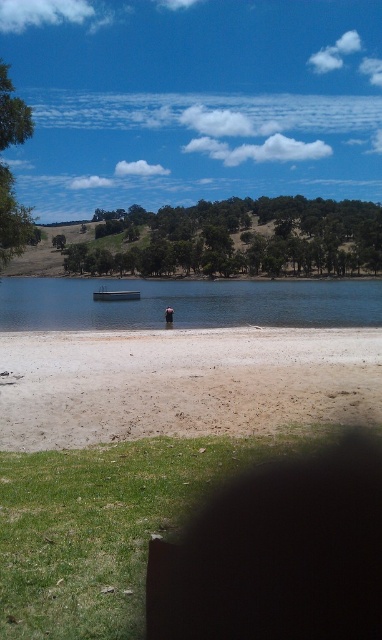
Question: Is brown sandy beach at lower center behind green leafy trees at upper center?

Choices:
 (A) yes
 (B) no

Answer: (B)

Question: Among these objects, which one is nearest to the camera?

Choices:
 (A) green leafy tree at left
 (B) clear blue water at center

Answer: (A)

Question: Is green grass at lower left wider than metallic silver boat at center?

Choices:
 (A) yes
 (B) no

Answer: (B)

Question: Does brown sandy beach at lower center appear under clear blue water at center?

Choices:
 (A) yes
 (B) no

Answer: (A)

Question: Which point is closer to the camera?

Choices:
 (A) (9, 124)
 (B) (103, 266)
 (C) (207, 470)
 (D) (71, 296)

Answer: (C)

Question: Which object appears closest to the camera in this image?

Choices:
 (A) metallic silver boat at center
 (B) brown sandy beach at lower center

Answer: (B)